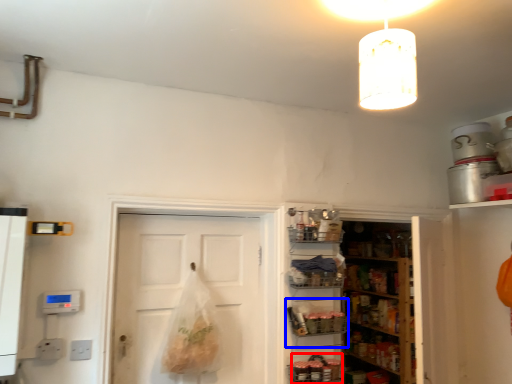
Question: Which object appears closest to the camera in this image, food (highlighted by a red box) or shelf (highlighted by a blue box)?

Choices:
 (A) food
 (B) shelf

Answer: (A)